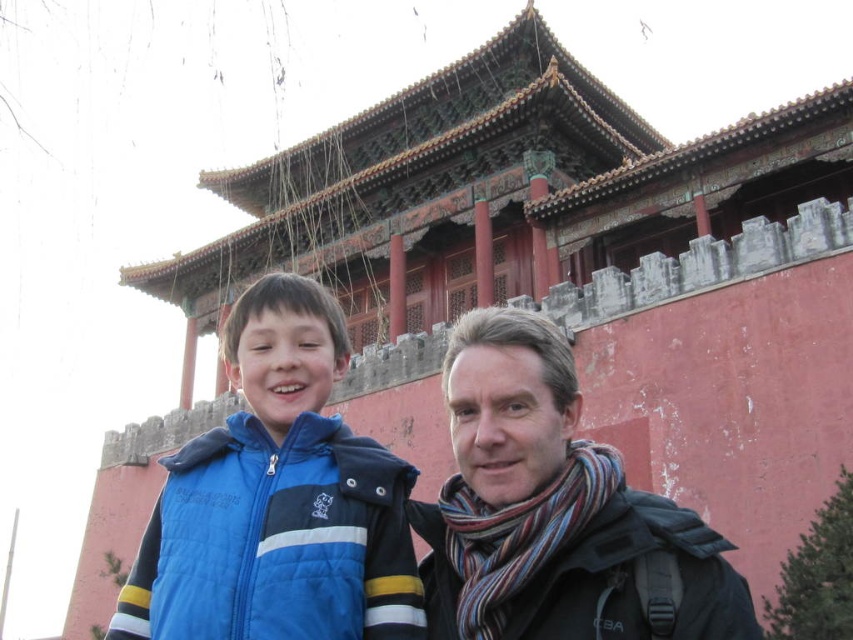
Question: Among these objects, which one is nearest to the camera?

Choices:
 (A) striped scarf at center
 (B) blue quilted jacket at center

Answer: (A)

Question: Which object appears closest to the camera in this image?

Choices:
 (A) striped scarf at center
 (B) blue quilted jacket at center

Answer: (A)

Question: Is blue quilted jacket at center further to the viewer compared to striped scarf at center?

Choices:
 (A) no
 (B) yes

Answer: (B)

Question: Does blue quilted jacket at center appear on the right side of striped scarf at center?

Choices:
 (A) yes
 (B) no

Answer: (B)

Question: Is blue quilted jacket at center closer to camera compared to striped scarf at center?

Choices:
 (A) no
 (B) yes

Answer: (A)

Question: Which of the following is the farthest from the observer?

Choices:
 (A) striped scarf at center
 (B) blue quilted jacket at center

Answer: (B)